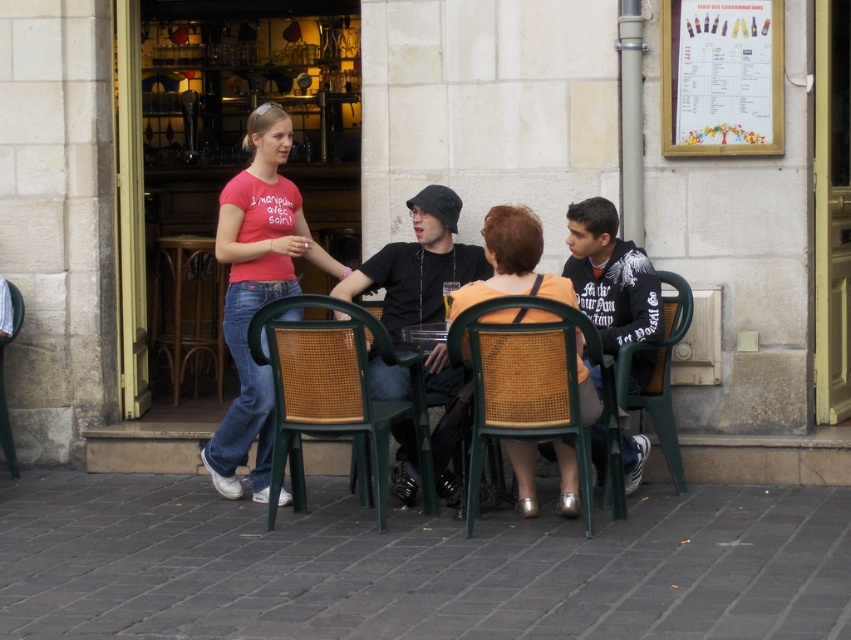
You are a customer sitting at the brown wicker table at left in an outdoor cafe. You want to move to the woven cane chair at center. Which direction should you move to reach it?

The woven cane chair at center is positioned on the right side of brown wicker table at left, so you should move to the right to reach the woven cane chair at center.

You are standing at the camera position and want to grab the green cane chair at center. Can you reach it without moving?

The green cane chair at center is 7.61 meters away from the camera, so you cannot reach it without moving closer.